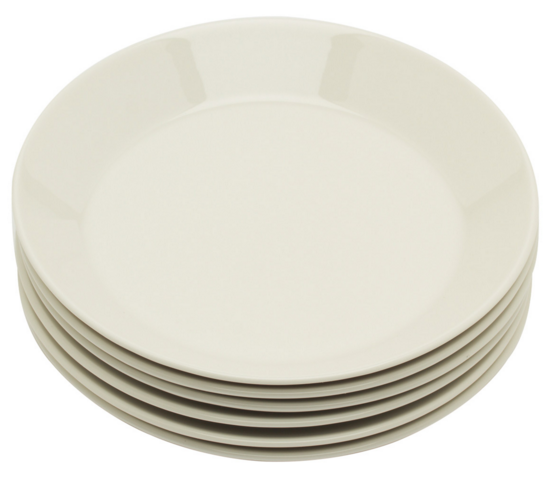
The height and width of the screenshot is (477, 555). Find the location of `plates`. plates is located at coordinates (282, 382), (282, 394), (284, 406), (282, 428), (282, 447), (286, 464).